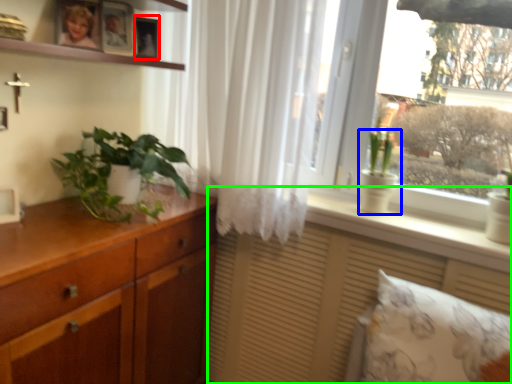
Question: Which is nearer to the picture frame (highlighted by a red box)? houseplant (highlighted by a blue box) or vanity (highlighted by a green box).

Choices:
 (A) houseplant
 (B) vanity

Answer: (A)